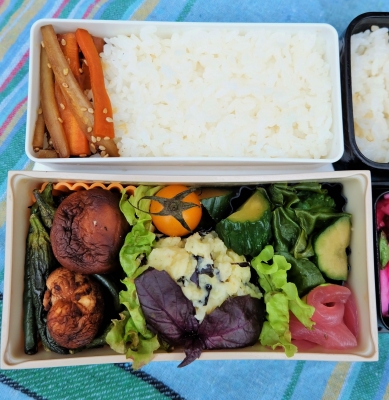
Identify the location of dish. The width and height of the screenshot is (389, 400). pos(360,248).